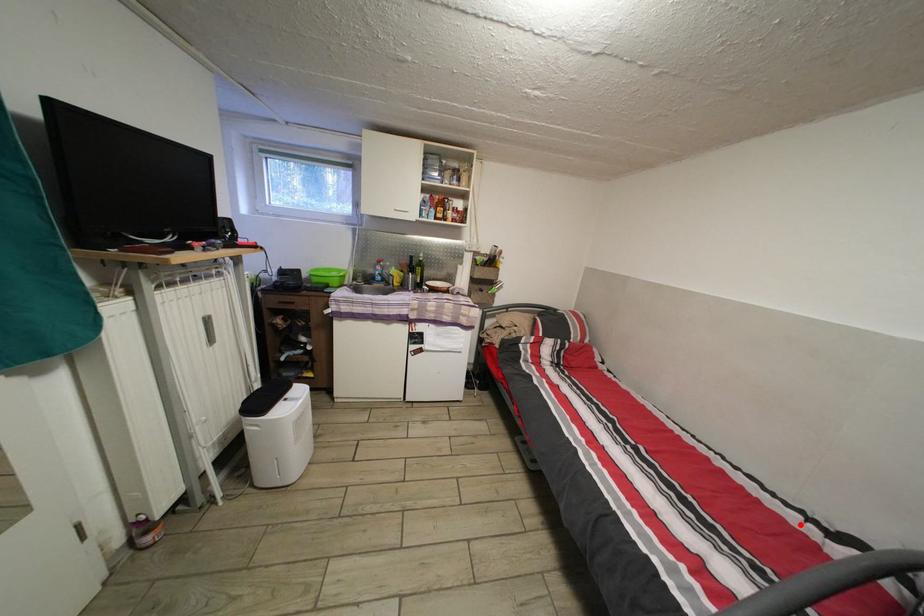
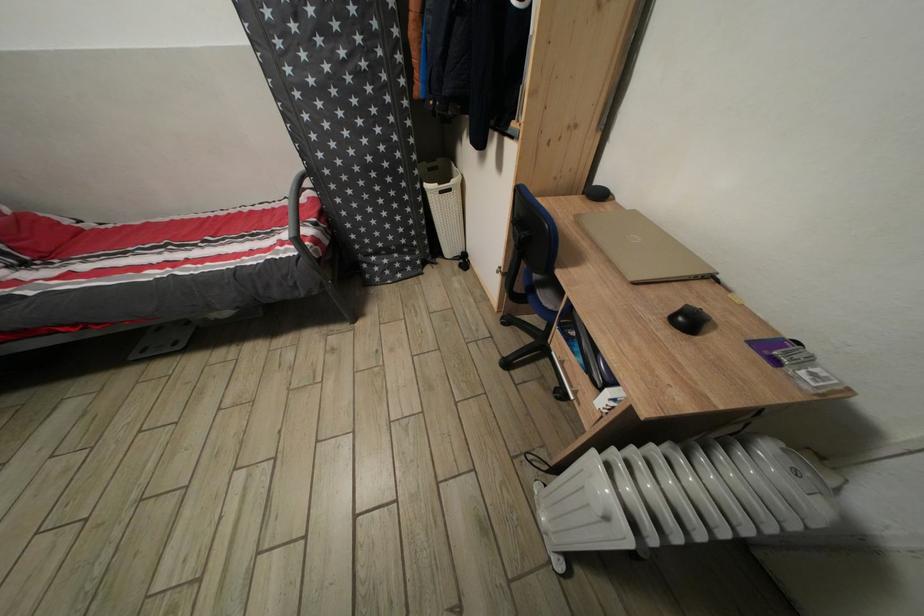
The point at the highlighted location is marked in the first image. Where is the corresponding point in the second image?

(294, 209)